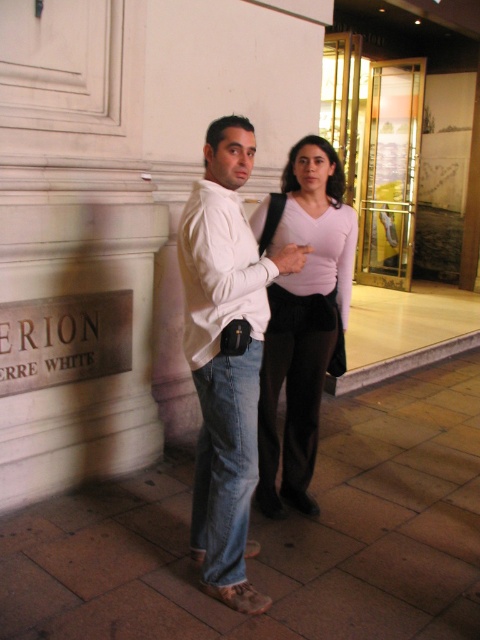
You are a photographer standing at the entrance of the ERION building. You want to take a portrait of the matte white shirt at center. What is the minimum distance you should set your camera lens to focus on to capture the person clearly?

The matte white shirt at center is 2.09 meters away from the camera, so you should set the focus distance to at least 2.09 meters to ensure the person is in clear focus.

You are a photographer taking a picture of the two people in front of the ERION building. You notice the matte white shirt at center and the pink matte shirt at center. Which one should you adjust to ensure both shirts are visible in the frame?

The matte white shirt at center is located below the pink matte shirt at center. To ensure both shirts are visible, adjust the matte white shirt at center upwards or the pink matte shirt at center downwards so they don not overlap.

You are a photographer trying to capture a full body shot of the matte white shirt at center and denim jeans at lower center. Which object should you focus on first to ensure both are in frame?

The matte white shirt at center is much taller than the denim jeans at lower center, so you should focus on the matte white shirt at center first to ensure both are in frame.